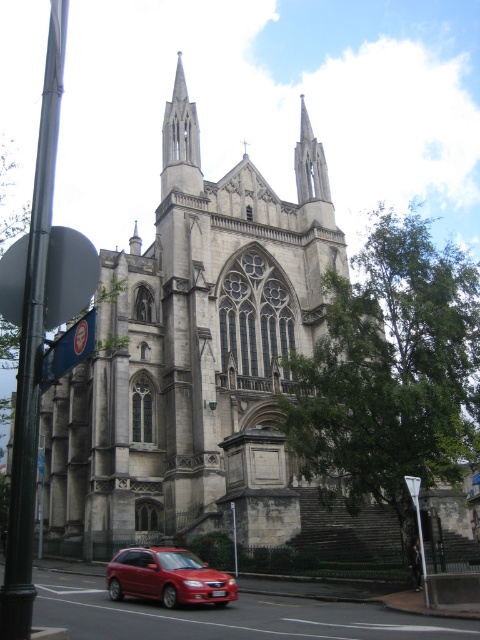
You are a photographer planning to take a wide shot of the cathedral. You notice the shiny red sedan at lower center and the smooth stone spire at upper center. Which object should you focus on to ensure it takes up more of the frame?

The smooth stone spire at upper center should be focused on because it occupies more space than the shiny red sedan at lower center.

You are standing at the entrance of the cathedral and see the shiny red sedan at lower center and the smooth stone spire at upper center. Which object is taller?

The smooth stone spire at upper center is taller than the shiny red sedan at lower center.

You are standing in front of the cathedral and see a shiny red sedan at lower center. There is a point marked at coordinates (x=168, y=577). Where is this point located?

The point at (x=168, y=577) is located on the shiny red sedan at lower center.